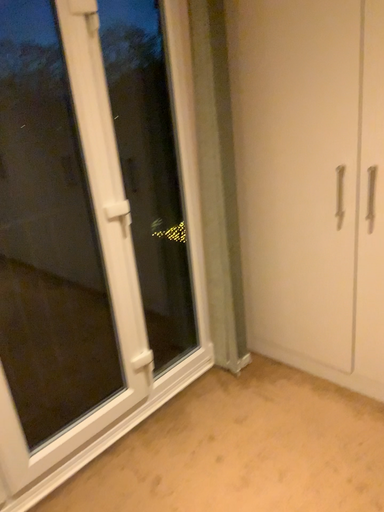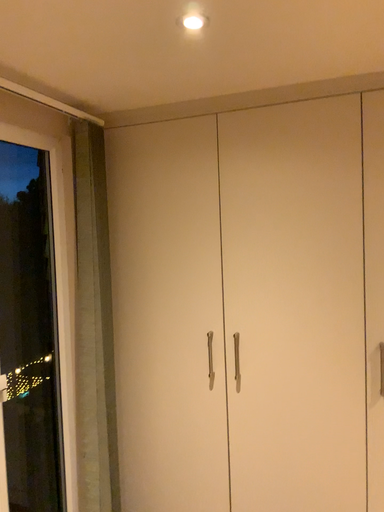
Question: Which way did the camera rotate in the video?

Choices:
 (A) rotated left
 (B) rotated right

Answer: (B)